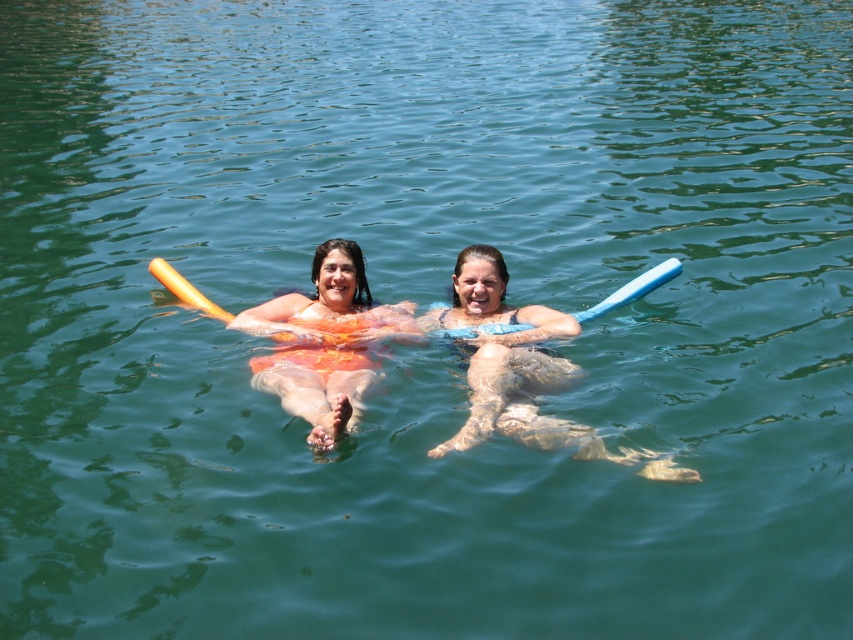
Between blue rubber float at center and orange fabric at center, which one is positioned higher?

orange fabric at center is higher up.

In the scene shown: Can you confirm if blue rubber float at center is taller than orange fabric at center?

Yes.

Is point (479, 272) positioned in front of point (392, 330)?

Yes, point (479, 272) is in front of point (392, 330).

What are the coordinates of `blue rubber float at center` in the screenshot? It's located at (520, 371).

Is point (543, 380) positioned in front of point (614, 300)?

Yes.

Can you confirm if blue rubber float at center is positioned below blue foam paddle at center?

Indeed, blue rubber float at center is positioned under blue foam paddle at center.

Is point (548, 381) more distant than point (635, 284)?

No, (548, 381) is closer to viewer.

Locate an element on the screen. Image resolution: width=853 pixels, height=640 pixels. blue rubber float at center is located at coordinates (520, 371).

Does orange fabric at center have a lesser height compared to blue foam paddle at center?

In fact, orange fabric at center may be taller than blue foam paddle at center.

Where is `orange fabric at center`? The image size is (853, 640). orange fabric at center is located at coordinates (323, 342).

Who is more distant from viewer, (358, 378) or (625, 285)?

Positioned behind is point (625, 285).

Where is `orange fabric at center`? orange fabric at center is located at coordinates (323, 342).